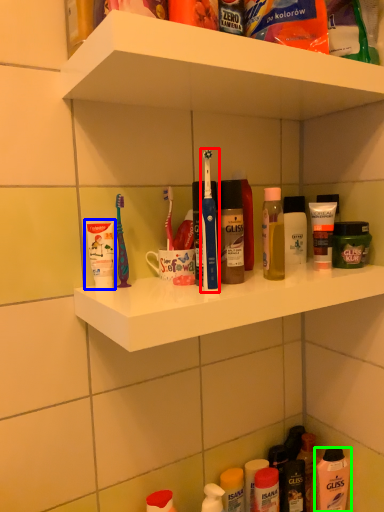
Question: Which is farther away from toothbrush (highlighted by a red box)? toiletry (highlighted by a blue box) or mouthwash (highlighted by a green box)?

Choices:
 (A) toiletry
 (B) mouthwash

Answer: (B)